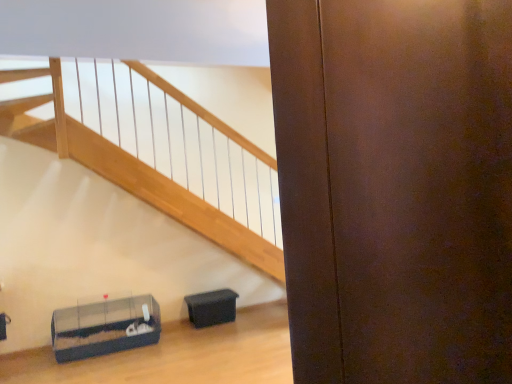
You are a GUI agent. You are given a task and a screenshot of the screen. Output one action in this format:
    pyautogui.click(x=<x>, y=<y>)
    Task: Click on the empty space that is ontop of black plastic container at lower center, placed as the 2th furniture when sorted from left to right
    
    Given the screenshot: What is the action you would take?
    pyautogui.click(x=209, y=294)